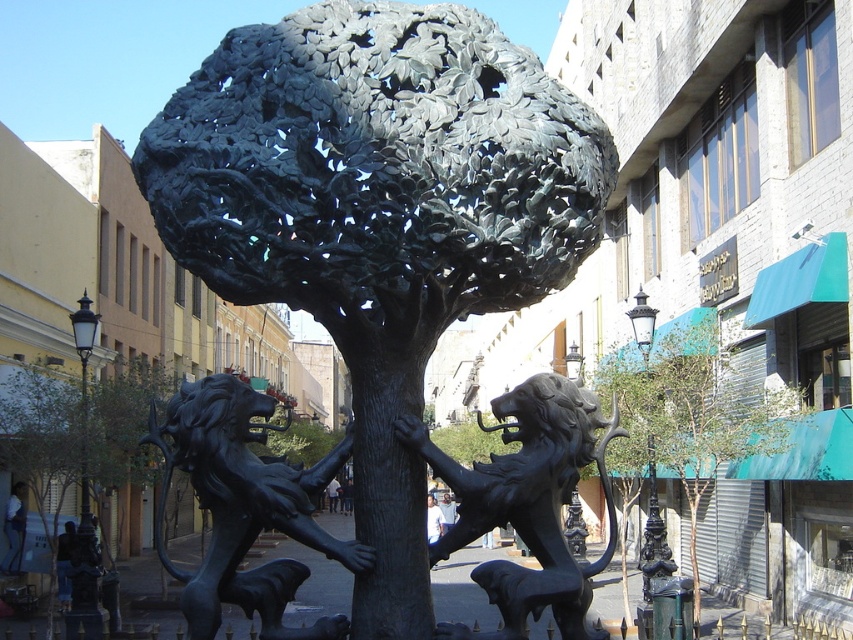
You are an urban planner assessing the sculpture in the image. The black polished stone lions at center and bronze textured tree at center are part of the sculpture. From the perspective of someone standing in front of the sculpture, which object is on the left?

The bronze textured tree at center is on the left side of the black polished stone lions at center, so the bronze textured tree at center is on the left.

You are an art student analyzing the urban sculpture. From your viewpoint, which object is positioned to the right side of the other between the bronze tree at center and the black polished stone lions at center?

The bronze tree at center is to the right of the black polished stone lions at center.